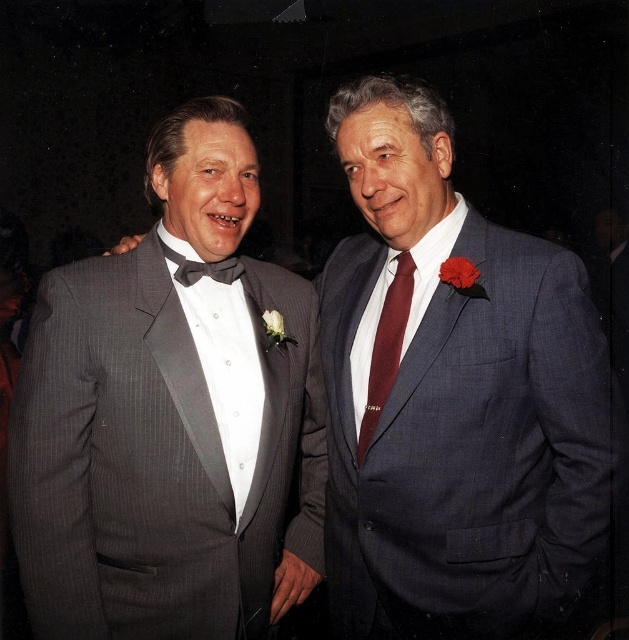
You are a photographer adjusting the camera focus. The two men are standing close, and you need to ensure both the maroon silk tie at center and the black satin bow tie at left are in focus. The camera has a depth of field that can cover 14 inches. Will both ties be in focus?

The maroon silk tie at center and the black satin bow tie at left are 13.96 inches apart from each other, so yes, both ties will be in focus since the distance between them is within the camera depth of field of 14 inches.

You are a photographer adjusting the lighting for a portrait. You notice the gray pinstripe tuxedo at left and the black satin bow tie at left in the frame. Which object should you focus on first to ensure proper exposure, considering their positions?

The gray pinstripe tuxedo at left is in front of the black satin bow tie at left, so you should focus on the gray pinstripe tuxedo at left first to ensure proper exposure since it is closer to the camera.

You are taking a photo of two men standing in front of you. You want to focus on the closer point between point (152, 273) and point (187, 285). Which point should you focus on?

Point (152, 273) is closer to the viewer than point (187, 285), so you should focus on point (152, 273).